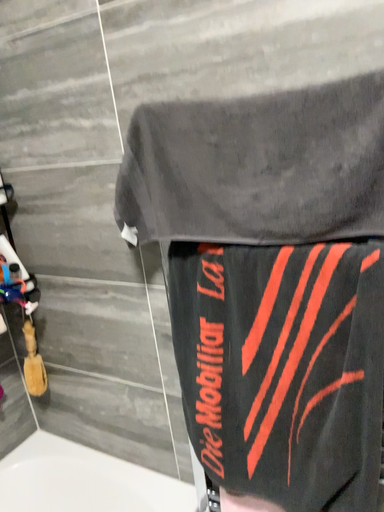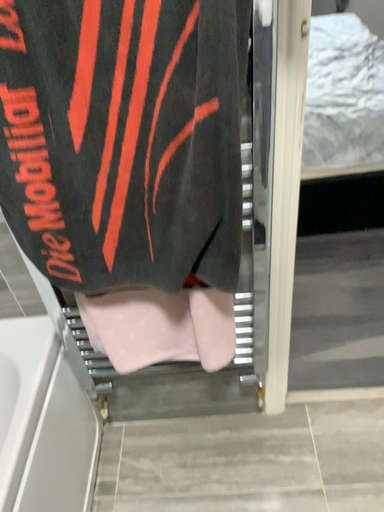
Question: How did the camera likely rotate when shooting the video?

Choices:
 (A) rotated right
 (B) rotated left

Answer: (A)